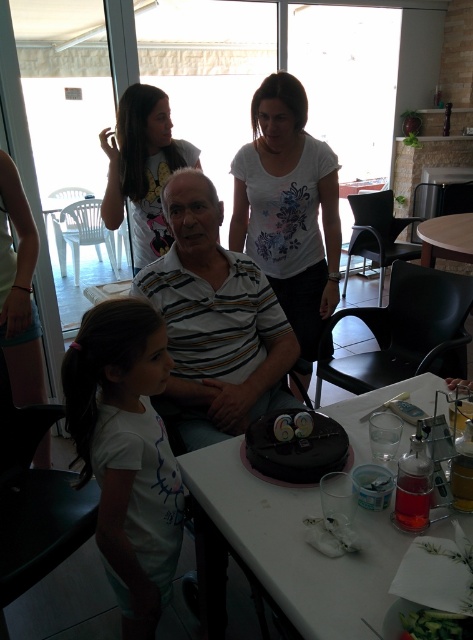
Question: Does striped cotton shirt at center have a smaller size compared to wooden table at center?

Choices:
 (A) no
 (B) yes

Answer: (B)

Question: Among these objects, which one is nearest to the camera?

Choices:
 (A) white glossy table at center
 (B) chocolate matte cake at center
 (C) wooden table at center
 (D) white cotton shirt at upper center

Answer: (A)

Question: Can you confirm if white glossy table at center is wider than white floral shirt at center?

Choices:
 (A) no
 (B) yes

Answer: (B)

Question: Which object is farther from the camera taking this photo?

Choices:
 (A) white cotton shirt at lower left
 (B) wooden table at center

Answer: (B)

Question: Can you confirm if white glossy table at center is positioned to the left of wooden table at center?

Choices:
 (A) yes
 (B) no

Answer: (A)

Question: Which is nearer to the white glossy table at center?

Choices:
 (A) chocolate matte cake at center
 (B) white floral shirt at center

Answer: (A)